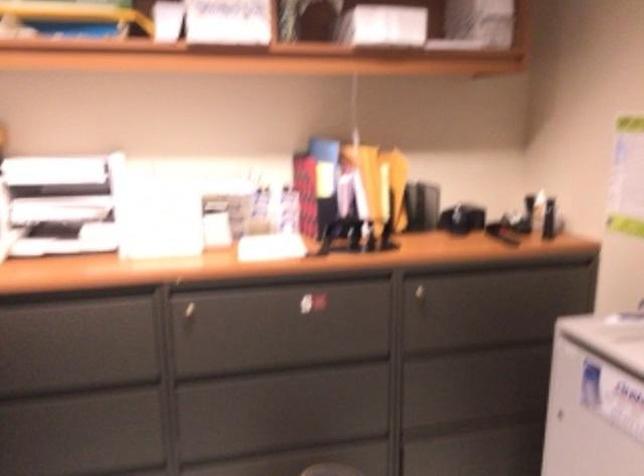
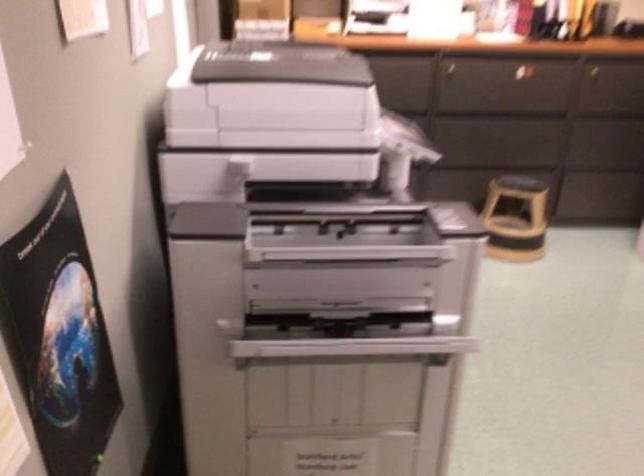
Question: The images are taken continuously from a first-person perspective. In which direction are you moving?

Choices:
 (A) Left
 (B) Right
 (C) Forward
 (D) Backward

Answer: (D)